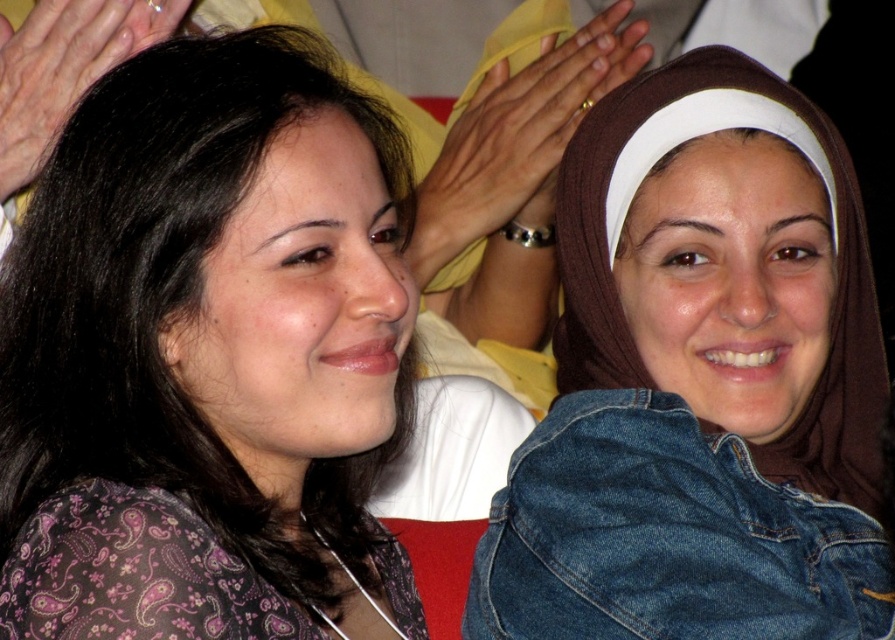
You are standing at a distance of 4 feet from the image. You want to reach the point marked at coordinates point [167,262]. Can you reach it without moving closer than 3.5 feet?

The distance of point [167,262] from viewer is 3.83 feet. Since 3.83 feet is between 3.5 feet and 4 feet, you can reach it without moving closer than 3.5 feet.

You are standing at the camera position and want to place a small gift at the point marked as point (612, 465). If your arm can reach up to 4 feet, will you be able to reach that point?

The distance of point (612, 465) from camera is 4.26 feet. Since your arm can only reach up to 4 feet, you will not be able to reach that point.